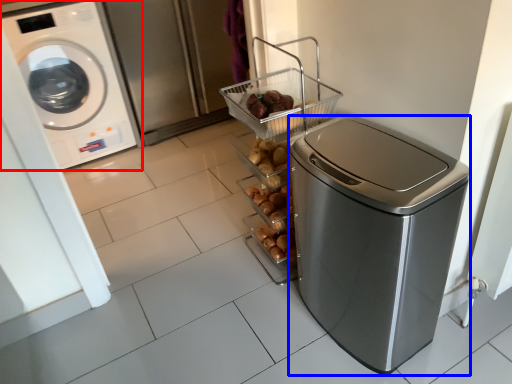
Question: Which of the following is the farthest to the observer, washing machine (highlighted by a red box) or dish washer (highlighted by a blue box)?

Choices:
 (A) washing machine
 (B) dish washer

Answer: (A)